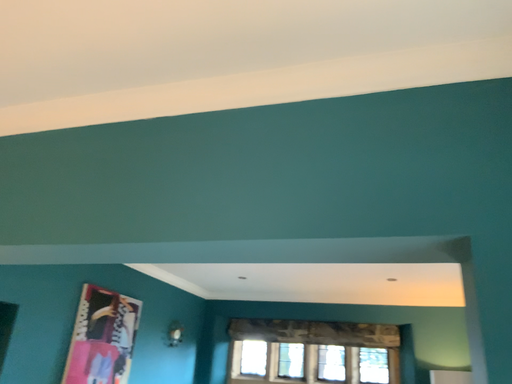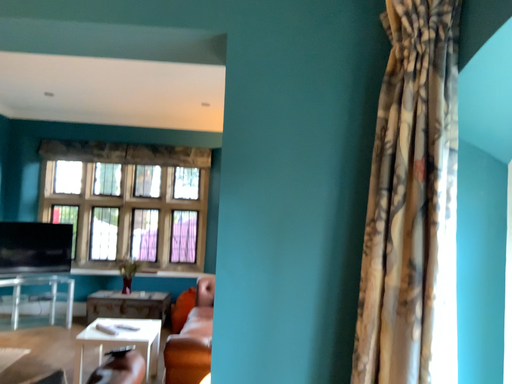
Question: How did the camera likely rotate when shooting the video?

Choices:
 (A) rotated left
 (B) rotated right

Answer: (B)